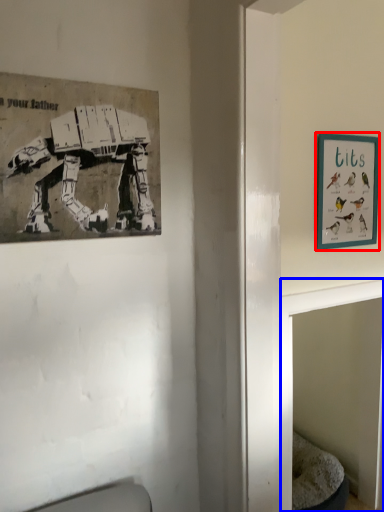
Question: Which object is further to the camera taking this photo, picture frame (highlighted by a red box) or table (highlighted by a blue box)?

Choices:
 (A) picture frame
 (B) table

Answer: (A)